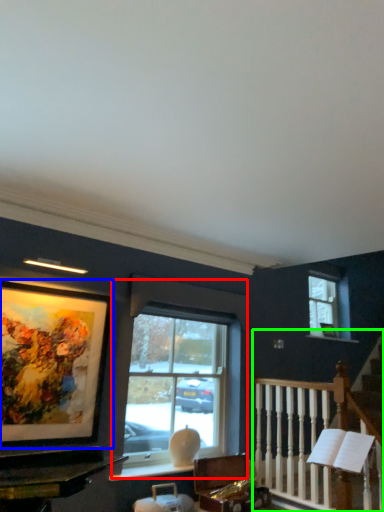
Question: Considering the real-world distances, which object is closest to window (highlighted by a red box)? picture frame (highlighted by a blue box) or rail (highlighted by a green box).

Choices:
 (A) picture frame
 (B) rail

Answer: (B)